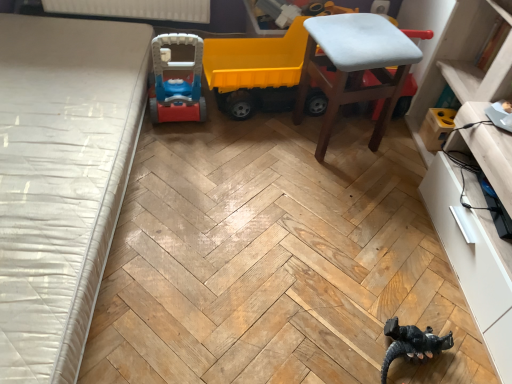
Find the location of a particular element. The image size is (512, 384). free space that is in between white glossy dresser at lower right and light blue fabric stool at upper right is located at coordinates (395, 214).